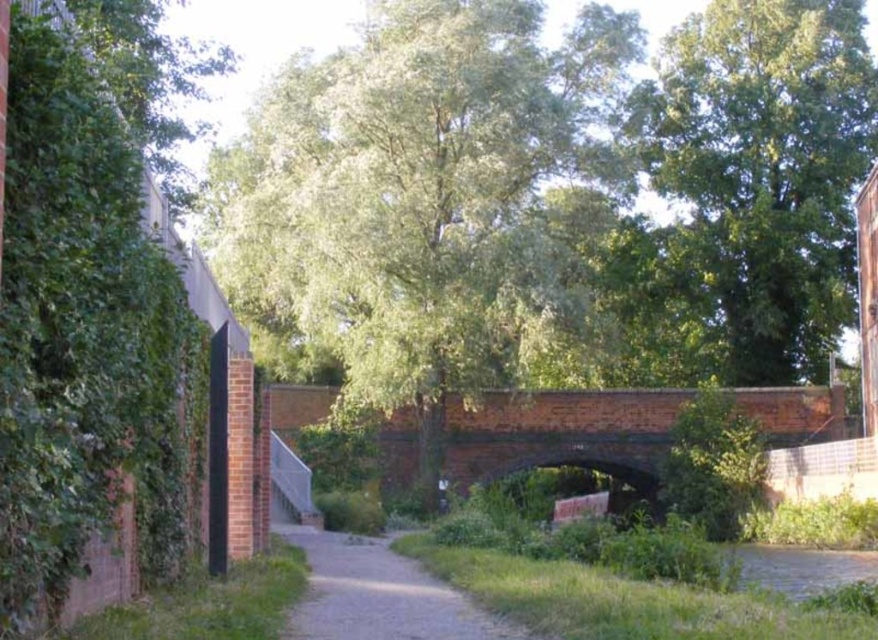
Is green leafy tree at upper center bigger than dirt/gravel path at center?

Indeed, green leafy tree at upper center has a larger size compared to dirt/gravel path at center.

Who is taller, green leafy tree at upper center or dirt/gravel path at center?

green leafy tree at upper center is taller.

Between point (771, 257) and point (329, 536), which one is positioned behind?

The point (771, 257) is more distant.

Locate an element on the screen. green leafy tree at upper center is located at coordinates (760, 176).

The height and width of the screenshot is (640, 878). What do you see at coordinates (430, 198) in the screenshot?
I see `green leafy tree at center` at bounding box center [430, 198].

Is point (415, 51) closer to camera compared to point (472, 442)?

Yes, it is.

Identify the location of green leafy tree at center. This screenshot has width=878, height=640. (430, 198).

Can you confirm if green leafy tree at center is positioned above dirt/gravel path at center?

Yes.

Between green leafy tree at center and dirt/gravel path at center, which one appears on the right side from the viewer's perspective?

From the viewer's perspective, dirt/gravel path at center appears more on the right side.

You are a GUI agent. You are given a task and a screenshot of the screen. Output one action in this format:
    pyautogui.click(x=<x>, y=<y>)
    Task: Click on the green leafy tree at center
    This screenshot has height=640, width=878.
    Given the screenshot: What is the action you would take?
    pyautogui.click(x=430, y=198)